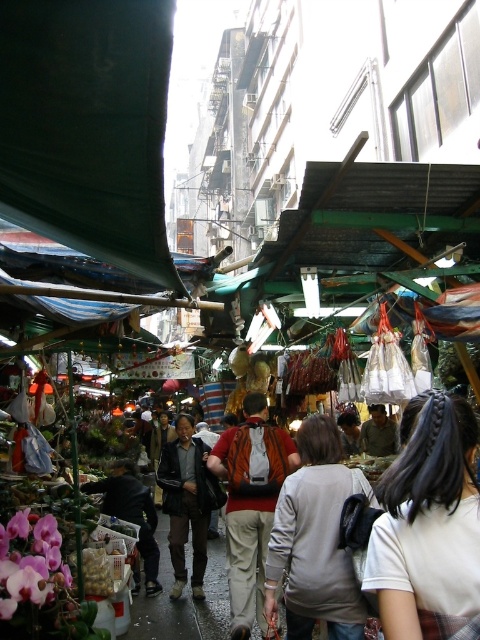
Between point (129, 104) and point (452, 400), which one is positioned in front?

Positioned in front is point (129, 104).

Locate an element on the screen. dark green fabric canopy at upper left is located at coordinates (87, 125).

Who is positioned more to the right, white matte hair at center or orange fabric backpack at center?

Positioned to the right is white matte hair at center.

Does point (408, 580) lie behind point (256, 516)?

That is False.

Between point (384, 577) and point (239, 484), which one is positioned in front?

Point (384, 577) is more forward.

This screenshot has height=640, width=480. Find the location of `white matte hair at center`. white matte hair at center is located at coordinates (428, 524).

Is white matte hair at center further to the viewer compared to dark brown leather jacket at center?

No.

Between white matte hair at center and dark brown leather jacket at center, which one has less height?

Standing shorter between the two is dark brown leather jacket at center.

Describe the element at coordinates (428, 524) in the screenshot. I see `white matte hair at center` at that location.

I want to click on white matte hair at center, so click(428, 524).